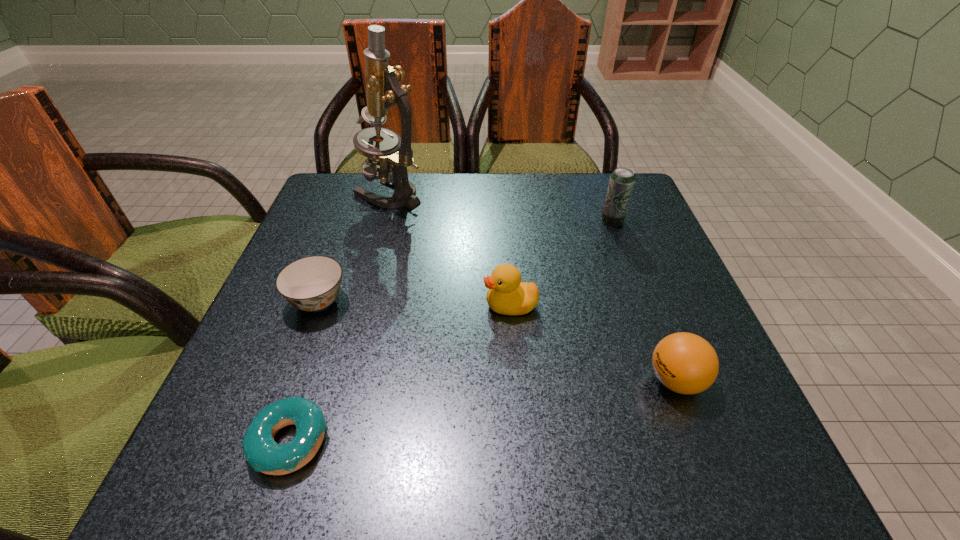
This screenshot has height=540, width=960. I want to click on unoccupied area between the third object from right to left and the soup bowl, so click(414, 303).

Identify the location of vacant space that's between the ping-pong ball and the soup bowl. (497, 341).

You are a GUI agent. You are given a task and a screenshot of the screen. Output one action in this format:
    pyautogui.click(x=<x>, y=<y>)
    Task: Click on the free area in between the tallest object and the nearest object
    
    Given the screenshot: What is the action you would take?
    tap(340, 318)

The width and height of the screenshot is (960, 540). Identify the location of vacant space that's between the nearest object and the tallest object. (340, 318).

Image resolution: width=960 pixels, height=540 pixels. What are the coordinates of `vacant region between the second farthest object and the nearest object` in the screenshot? It's located at (451, 331).

The image size is (960, 540). In order to click on vacant space that's between the fourth object from left to right and the microscope in this screenshot , I will do `click(450, 249)`.

The image size is (960, 540). Find the location of `free space between the farthest object and the soup bowl`. free space between the farthest object and the soup bowl is located at coordinates (353, 247).

Locate an element on the screen. The image size is (960, 540). object that ranks as the fifth closest to the beer can is located at coordinates point(264,455).

Locate which object ranks third in proximity to the second shortest object. Please provide its 2D coordinates. Your answer should be formatted as a tuple, i.e. [(x, y)], where the tuple contains the x and y coordinates of a point satisfying the conditions above.

[(507, 295)]

Identify the location of blank space that satisfies the following two spatial constraints: 1. on the front side of the soup bowl; 2. on the left side of the doughnut. Image resolution: width=960 pixels, height=540 pixels. coord(266,442).